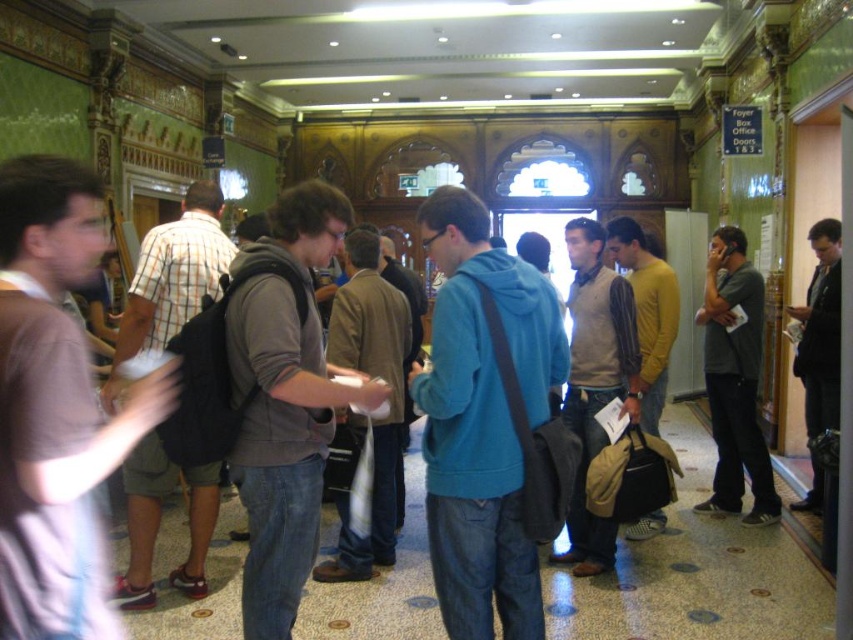
Question: Can you confirm if teal matte hoodie at center is bigger than plaid cotton shirt at left?

Choices:
 (A) no
 (B) yes

Answer: (B)

Question: Considering the real-world distances, which object is farthest from the gray hoodie at center?

Choices:
 (A) matte brown sweater at center
 (B) gray matte shirt at right
 (C) brown leather jacket at center

Answer: (B)

Question: Which point appears closest to the camera in this image?

Choices:
 (A) (798, 372)
 (B) (589, 408)

Answer: (B)

Question: Can you confirm if matte brown sweater at center is thinner than gray matte shirt at right?

Choices:
 (A) yes
 (B) no

Answer: (A)

Question: Can you confirm if plaid cotton shirt at left is bigger than gray matte shirt at right?

Choices:
 (A) no
 (B) yes

Answer: (A)

Question: Which point appears closest to the camera in this image?

Choices:
 (A) (820, 429)
 (B) (370, 369)
 (C) (442, 307)
 (D) (637, 326)

Answer: (C)